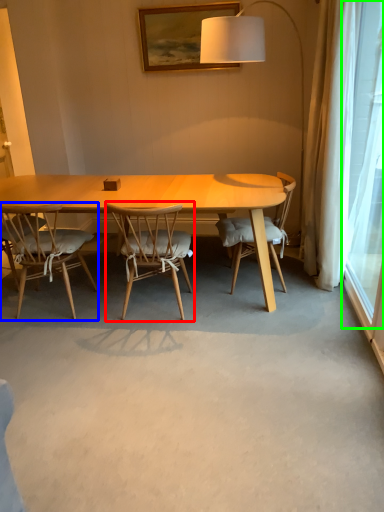
Question: Considering the real-world distances, which object is farthest from chair (highlighted by a red box)? chair (highlighted by a blue box) or window screen (highlighted by a green box)?

Choices:
 (A) chair
 (B) window screen

Answer: (B)